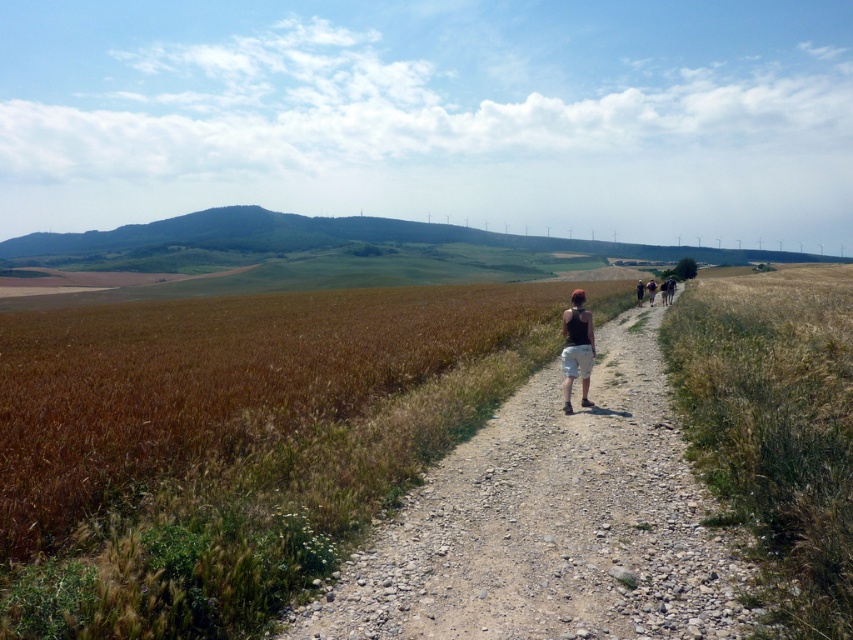
Can you confirm if dirt path at center is shorter than brown cotton shorts at center-right?

Indeed, dirt path at center has a lesser height compared to brown cotton shorts at center-right.

Who is positioned more to the right, dirt path at center or brown cotton shorts at center-right?

Positioned to the right is brown cotton shorts at center-right.

Find the location of a particular element. The height and width of the screenshot is (640, 853). dirt path at center is located at coordinates (550, 524).

Between dark brown shorts at center-right and brown cotton shorts at center-right, which one has more height?

With more height is brown cotton shorts at center-right.

Between dark brown shorts at center-right and brown cotton shorts at center-right, which one appears on the left side from the viewer's perspective?

Positioned to the left is brown cotton shorts at center-right.

Between point (651, 292) and point (641, 301), which one is positioned behind?

The point (641, 301) is more distant.

The image size is (853, 640). In order to click on dark brown shorts at center-right in this screenshot , I will do `click(650, 291)`.

Does point (485, 456) come farther from viewer compared to point (589, 317)?

No, it is not.

Which is behind, point (515, 403) or point (590, 358)?

Positioned behind is point (515, 403).

At what (x,y) coordinates should I click in order to perform the action: click on dirt path at center. Please return your answer as a coordinate pair (x, y). Image resolution: width=853 pixels, height=640 pixels. Looking at the image, I should click on (550, 524).

This screenshot has height=640, width=853. I want to click on dirt path at center, so click(x=550, y=524).